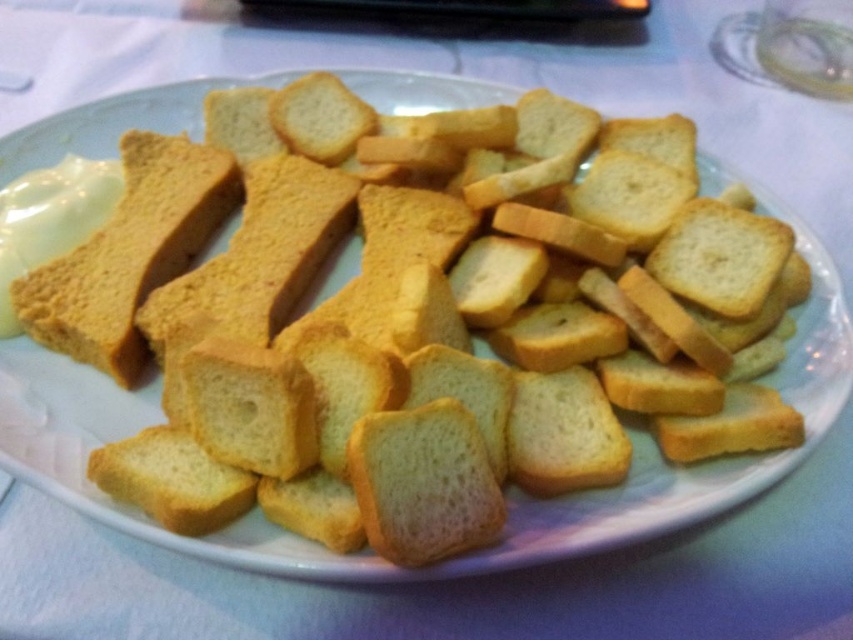
You are a baker trying to determine which bread piece to use for a recipe that requires a larger piece. Based on the image, which bread piece should you choose between the yellow crumbly bread at upper left and the golden crispy crouton at center?

The yellow crumbly bread at upper left should be chosen because its width surpasses that of the golden crispy crouton at center, making it the larger option.

You are standing in front of a plate with bread pieces. There are two points marked on the plate, one at coordinates point (231,209) and the other at point (469,426). If you want to reach the point that is closer to you, which coordinate should you aim for?

Point (469,426) is closer to you because point (231,209) is behind it.